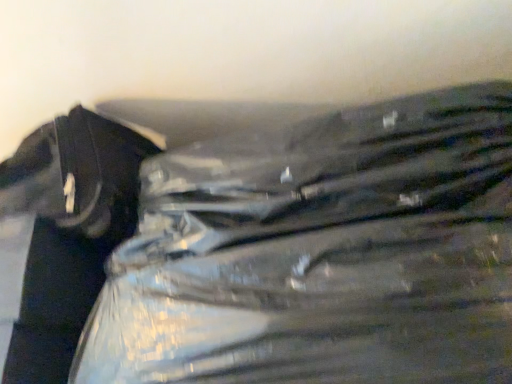
Question: Is metallic silver zipper at left inside or outside of transparent plastic bag at center?

Choices:
 (A) outside
 (B) inside

Answer: (A)

Question: In terms of height, does metallic silver zipper at left look taller or shorter compared to transparent plastic bag at center?

Choices:
 (A) tall
 (B) short

Answer: (A)

Question: Is point (67, 221) positioned closer to the camera than point (199, 322)?

Choices:
 (A) farther
 (B) closer

Answer: (A)

Question: In terms of height, does transparent plastic bag at center look taller or shorter compared to metallic silver zipper at left?

Choices:
 (A) short
 (B) tall

Answer: (A)

Question: From a real-world perspective, is transparent plastic bag at center positioned above or below metallic silver zipper at left?

Choices:
 (A) below
 (B) above

Answer: (A)

Question: Is transparent plastic bag at center inside or outside of metallic silver zipper at left?

Choices:
 (A) outside
 (B) inside

Answer: (A)

Question: Considering the positions of transparent plastic bag at center and metallic silver zipper at left in the image, is transparent plastic bag at center bigger or smaller than metallic silver zipper at left?

Choices:
 (A) small
 (B) big

Answer: (B)